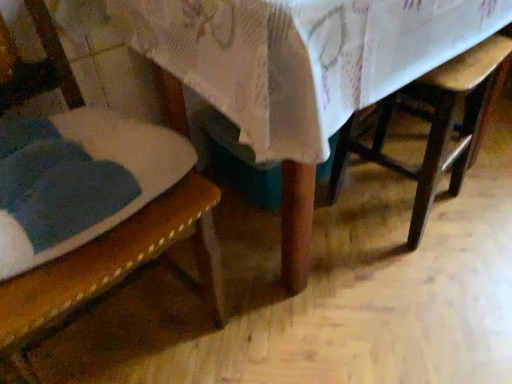
What are the coordinates of `wooden chair at lower right` in the screenshot? It's located at (435, 126).

The image size is (512, 384). What do you see at coordinates (301, 71) in the screenshot?
I see `wooden table at center` at bounding box center [301, 71].

Identify the location of wooden textured chair at left. The height and width of the screenshot is (384, 512). (118, 260).

Find the location of `wooden chair at lower right`. wooden chair at lower right is located at coordinates (435, 126).

Identify the location of table above the wooden chair at lower right (from the image's perspective). Image resolution: width=512 pixels, height=384 pixels. (301, 71).

From a real-world perspective, relative to wooden chair at lower right, is wooden table at center vertically above or below?

In terms of real-world spatial position, wooden table at center is above wooden chair at lower right.

Is wooden table at center inside or outside of wooden chair at lower right?

The correct answer is: outside.

Is wooden chair at lower right wider than wooden table at center?

No.

Would you say wooden chair at lower right contains wooden table at center?

No, wooden table at center is not inside wooden chair at lower right.

From a real-world perspective, who is located higher, wooden chair at lower right or wooden table at center?

wooden table at center.

From the image's perspective, is wooden chair at lower right located beneath wooden table at center?

Yes, from the image's perspective, wooden chair at lower right is beneath wooden table at center.

Considering the relative sizes of wooden textured chair at left and wooden table at center in the image provided, is wooden textured chair at left bigger than wooden table at center?

Actually, wooden textured chair at left might be smaller than wooden table at center.

Considering the positions of objects wooden textured chair at left and wooden table at center in the image provided, who is more to the left, wooden textured chair at left or wooden table at center?

wooden textured chair at left.

Is wooden textured chair at left positioned far away from wooden table at center?

They are positioned close to each other.

Is wooden textured chair at left spatially inside wooden table at center, or outside of it?

wooden textured chair at left is not inside wooden table at center, it's outside.

Does point (344, 38) come farther from viewer compared to point (64, 297)?

Yes, point (344, 38) is farther from viewer.

Is wooden table at center oriented towards wooden textured chair at left?

No, wooden table at center does not turn towards wooden textured chair at left.

Which of these two, wooden table at center or wooden textured chair at left, is wider?

wooden table at center.

Does wooden table at center contain wooden textured chair at left?

No, wooden textured chair at left is not inside wooden table at center.

Can you confirm if wooden chair at lower right is taller than wooden textured chair at left?

No.

In the scene shown: Considering the relative sizes of wooden chair at lower right and wooden textured chair at left in the image provided, is wooden chair at lower right thinner than wooden textured chair at left?

Correct, the width of wooden chair at lower right is less than that of wooden textured chair at left.

Is wooden textured chair at left at the back of wooden chair at lower right?

No, wooden chair at lower right is not facing the opposite direction of wooden textured chair at left.

In the scene shown: Is wooden chair at lower right positioned far away from wooden textured chair at left?

No, wooden chair at lower right is not far from wooden textured chair at left.

Can you confirm if wooden textured chair at left is bigger than wooden chair at lower right?

Yes, wooden textured chair at left is bigger than wooden chair at lower right.

From a real-world perspective, does wooden textured chair at left stand above wooden chair at lower right?

Correct, in the physical world, wooden textured chair at left is higher than wooden chair at lower right.

Could you tell me if wooden textured chair at left is turned towards wooden chair at lower right?

No, wooden textured chair at left is not turned towards wooden chair at lower right.

From the image's perspective, is wooden textured chair at left on top of wooden chair at lower right?

No, from the image's perspective, wooden textured chair at left is not above wooden chair at lower right.

The height and width of the screenshot is (384, 512). Find the location of `armchair that appears below the wooden table at center (from the image's perspective)`. armchair that appears below the wooden table at center (from the image's perspective) is located at coordinates (435, 126).

I want to click on table in front of the wooden chair at lower right, so click(x=301, y=71).

From the image, which object appears to be nearer to wooden table at center, wooden textured chair at left or wooden chair at lower right?

The object closer to wooden table at center is wooden textured chair at left.

Based on their spatial positions, is wooden chair at lower right or wooden table at center further from wooden textured chair at left?

The object further to wooden textured chair at left is wooden chair at lower right.

When comparing their distances from wooden textured chair at left, does wooden table at center or wooden chair at lower right seem further?

Among the two, wooden chair at lower right is located further to wooden textured chair at left.

When comparing their distances from wooden chair at lower right, does wooden textured chair at left or wooden table at center seem further?

The object further to wooden chair at lower right is wooden textured chair at left.

From the image, which object appears to be farther from wooden table at center, wooden chair at lower right or wooden textured chair at left?

Based on the image, wooden chair at lower right appears to be further to wooden table at center.

Estimate the real-world distances between objects in this image. Which object is further from wooden chair at lower right, wooden table at center or wooden textured chair at left?

wooden textured chair at left lies further to wooden chair at lower right than the other object.

What are the coordinates of `table located between wooden textured chair at left and wooden chair at lower right in the left-right direction` in the screenshot? It's located at (301, 71).